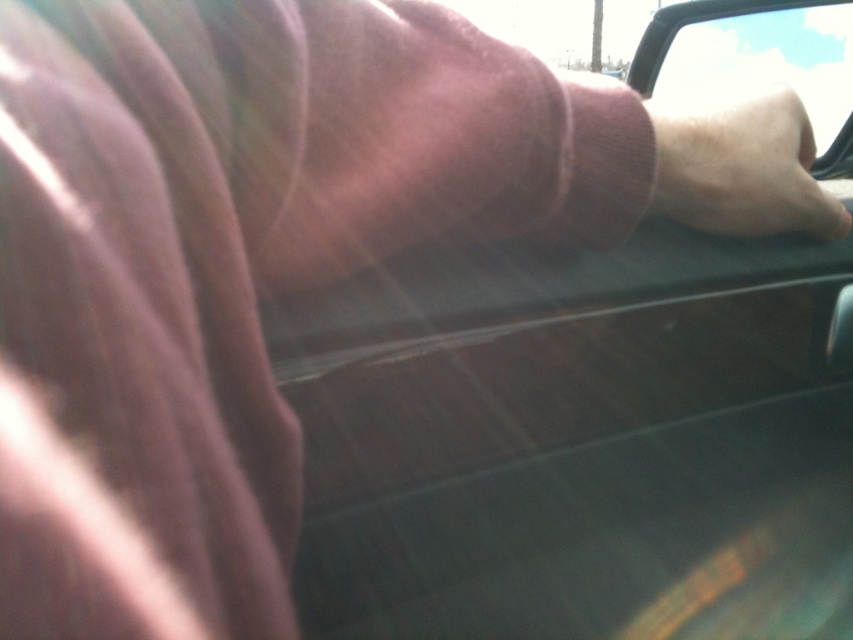
Does skinny white hand at upper right have a greater height compared to black plastic car window at upper right?

In fact, skinny white hand at upper right may be shorter than black plastic car window at upper right.

Which of these two, skinny white hand at upper right or black plastic car window at upper right, stands taller?

black plastic car window at upper right

Identify the location of skinny white hand at upper right. (741, 164).